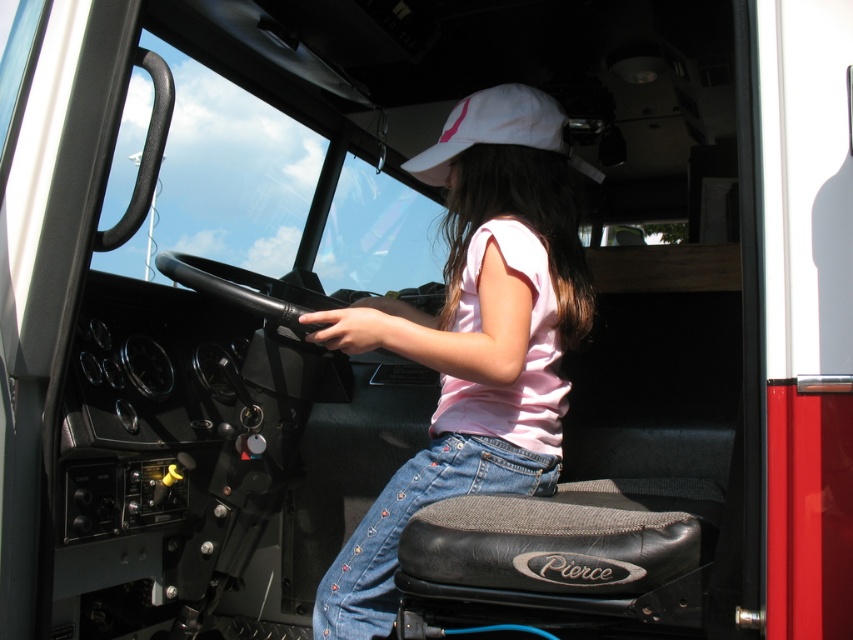
This screenshot has width=853, height=640. I want to click on pink cotton shirt at center, so click(x=473, y=337).

Does pink cotton shirt at center appear under white fabric baseball cap at upper center?

Yes, pink cotton shirt at center is below white fabric baseball cap at upper center.

Who is more forward, [454,330] or [403,164]?

Point [454,330] is more forward.

The image size is (853, 640). Identify the location of pink cotton shirt at center. (473, 337).